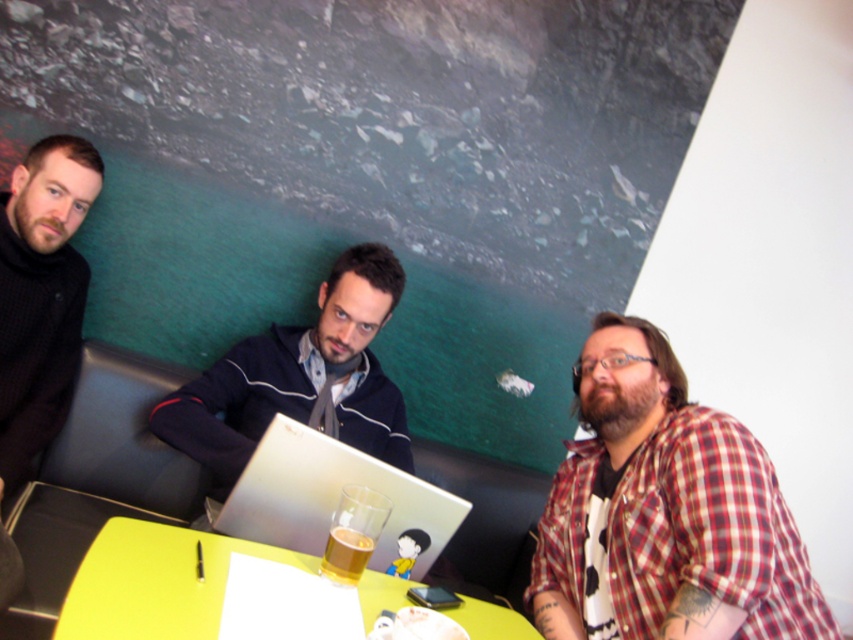
Question: Does yellow matte table at lower center appear under translucent glass beer at table center?

Choices:
 (A) no
 (B) yes

Answer: (B)

Question: Which point appears closest to the camera in this image?

Choices:
 (A) (373, 545)
 (B) (306, 436)

Answer: (A)

Question: Is yellow matte table at lower center positioned behind translucent glass beer at table center?

Choices:
 (A) yes
 (B) no

Answer: (B)

Question: Which object is closer to the camera taking this photo?

Choices:
 (A) yellow matte table at lower center
 (B) silver metallic laptop at center

Answer: (A)

Question: Is yellow matte table at lower center in front of translucent glass beer at table center?

Choices:
 (A) no
 (B) yes

Answer: (B)

Question: Which is farther from the yellow matte table at lower center?

Choices:
 (A) dark blue jacket at center
 (B) black woolen sweater at left
 (C) plaid shirt at right
 (D) translucent glass beer at table center

Answer: (B)